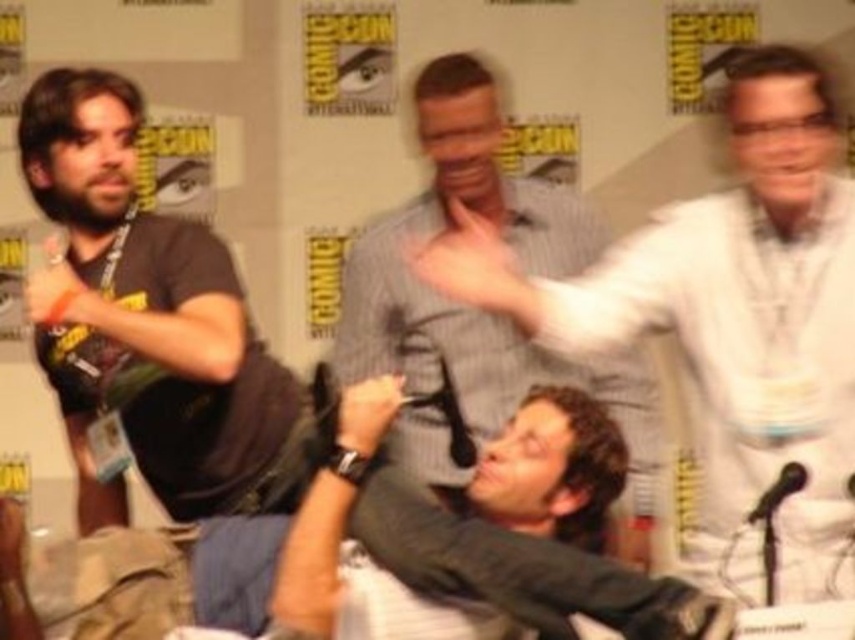
You are an event organizer at Comic Con and need to arrange seating based on the attendees clothing. You see a white shirt at upper right and a gray striped shirt at center. Which attendee should you seat first if you want to seat the smaller sized attendee first?

The white shirt at upper right should be seated first because it is smaller than the gray striped shirt at center.